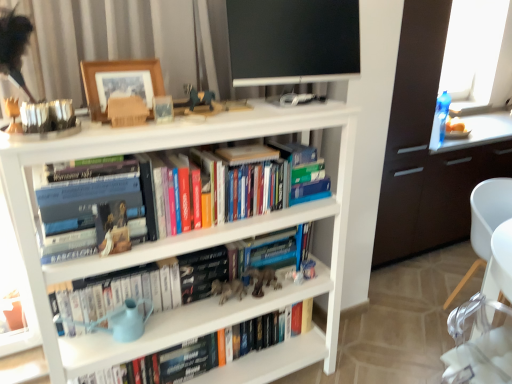
In order to click on vacant space underneath black glossy flat-screen tv at upper center (from a real-world perspective) in this screenshot , I will do `click(287, 105)`.